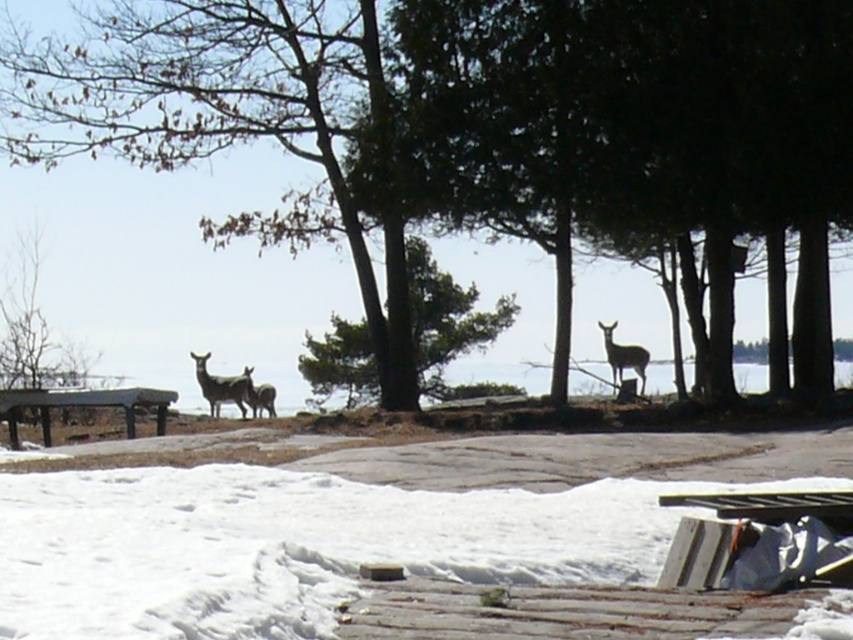
Question: Can you confirm if wooden picnic table at lower left is positioned below brown fur deer at center?

Choices:
 (A) no
 (B) yes

Answer: (B)

Question: Based on their relative distances, which object is farther from the green leafy tree at center?

Choices:
 (A) wooden picnic table at lower left
 (B) brown fur deer at center
 (C) white powdery snow at lower center
 (D) brown matte deer at center

Answer: (C)

Question: Which point is closer to the camera taking this photo?

Choices:
 (A) (231, 394)
 (B) (167, 394)
 (C) (399, 388)

Answer: (B)

Question: Is white powdery snow at lower center below wooden picnic table at lower left?

Choices:
 (A) yes
 (B) no

Answer: (B)

Question: Among these points, which one is nearest to the camera?

Choices:
 (A) (602, 324)
 (B) (242, 408)
 (C) (340, 384)

Answer: (B)

Question: Does white powdery snow at lower center have a smaller size compared to green textured tree at center?

Choices:
 (A) no
 (B) yes

Answer: (B)